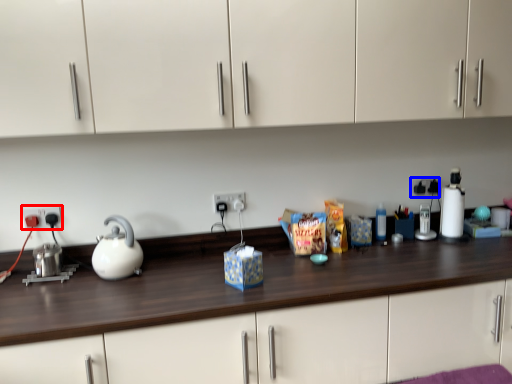
Question: Which point is closer to the camera, electric outlet (highlighted by a red box) or electric outlet (highlighted by a blue box)?

Choices:
 (A) electric outlet
 (B) electric outlet

Answer: (A)